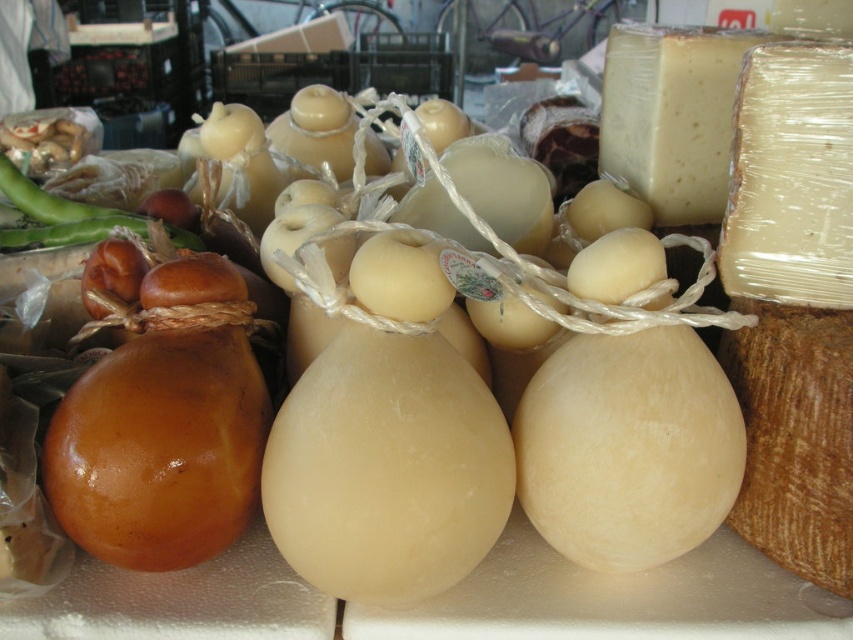
Question: Which object is farther from the camera taking this photo?

Choices:
 (A) translucent white cheese at upper right
 (B) white wrapped block of cheese at upper right

Answer: (A)

Question: Does white wrapped block of cheese at upper right have a lesser width compared to translucent white cheese at upper right?

Choices:
 (A) yes
 (B) no

Answer: (A)

Question: Does white wrapped block of cheese at upper right appear on the left side of translucent white cheese at upper right?

Choices:
 (A) no
 (B) yes

Answer: (A)

Question: Can you confirm if white wrapped block of cheese at upper right is positioned to the right of translucent white cheese at upper right?

Choices:
 (A) yes
 (B) no

Answer: (A)